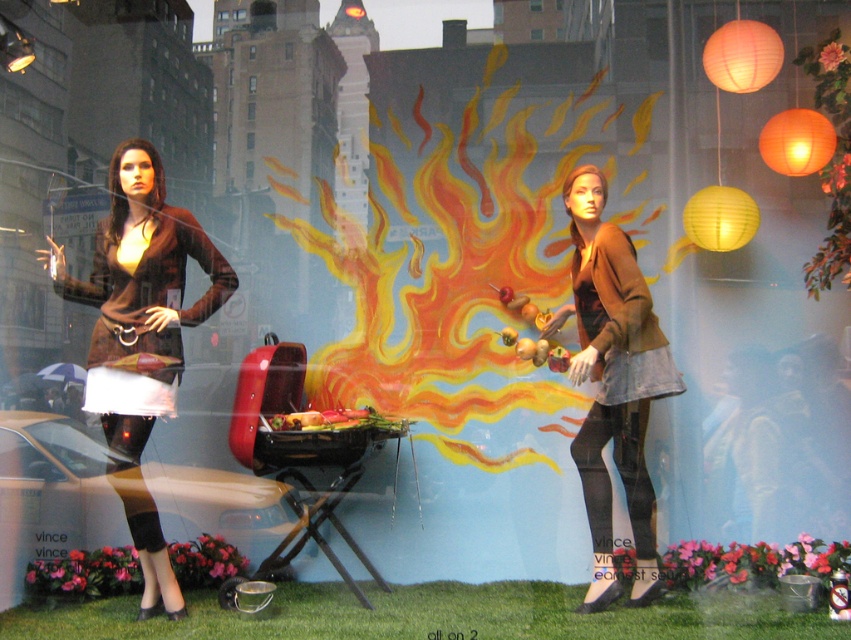
Question: Is matte brown sweater at left positioned before matte brown jacket at center?

Choices:
 (A) yes
 (B) no

Answer: (A)

Question: Which of the following is the closest to the observer?

Choices:
 (A) matte brown jacket at center
 (B) matte brown sweater at left

Answer: (B)

Question: Which point is farther from the camera taking this photo?

Choices:
 (A) (631, 515)
 (B) (133, 472)

Answer: (A)

Question: Does matte brown sweater at left come in front of matte brown jacket at center?

Choices:
 (A) yes
 (B) no

Answer: (A)

Question: Is matte brown sweater at left smaller than matte brown jacket at center?

Choices:
 (A) no
 (B) yes

Answer: (A)

Question: Among these points, which one is nearest to the camera?

Choices:
 (A) (126, 333)
 (B) (644, 285)

Answer: (A)